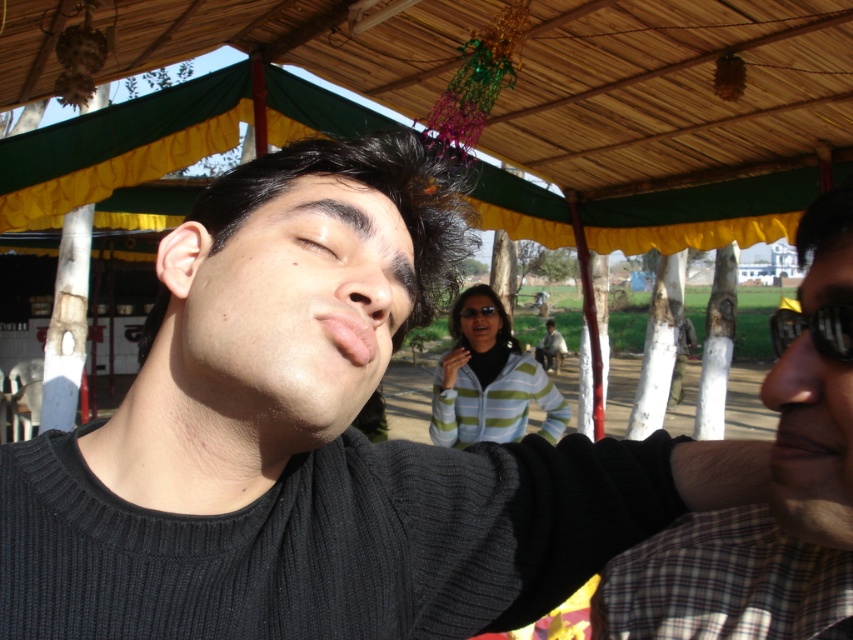
You are at a fair and want to find shade to avoid the sun. You see the green fabric canopy at upper center and the checkered fabric shirt at right. Which object provides shade above the other?

The green fabric canopy at upper center is located above the checkered fabric shirt at right, so it provides shade over the shirt.

You are designing a layout for a poster and need to place the black rubber goggles at right and brown matte eye at center. Since you want to maintain the original size ratio from the image, which object should you make wider in your design?

The black rubber goggles at right should be made wider in the design because its width in the image is larger than the brown matte eye at center.

In the scene shown: You are standing in the middle of the fairground and see two points marked in the image. Which point is closer to you, point (384, 77) or point (844, 248)?

Point (384, 77) is closer to you because it is further to the viewer than point (844, 248).